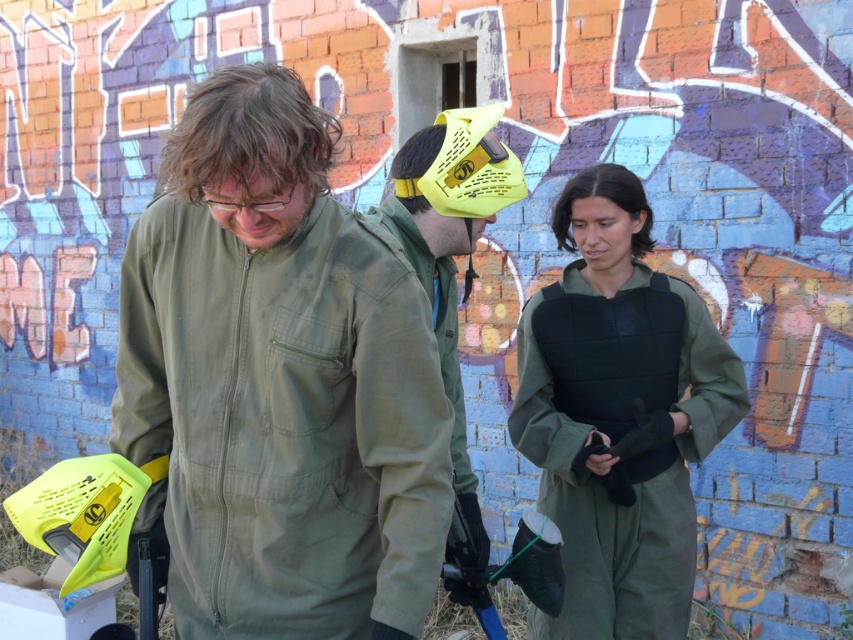
Question: Which of the following is the closest to the observer?

Choices:
 (A) (433, 182)
 (B) (396, 611)
 (C) (624, 356)

Answer: (B)

Question: Which object appears farthest from the camera in this image?

Choices:
 (A) matte yellow helmet at center
 (B) green matte vest at center
 (C) olive green fabric jacket at center

Answer: (B)

Question: Is olive green fabric jacket at center bigger than green matte vest at center?

Choices:
 (A) yes
 (B) no

Answer: (A)

Question: Can you confirm if green matte vest at center is positioned to the left of matte yellow helmet at center?

Choices:
 (A) yes
 (B) no

Answer: (B)

Question: Which is farther from the matte yellow helmet at center?

Choices:
 (A) olive green fabric jacket at center
 (B) green matte vest at center

Answer: (B)

Question: Does olive green fabric jacket at center appear under green matte vest at center?

Choices:
 (A) no
 (B) yes

Answer: (A)